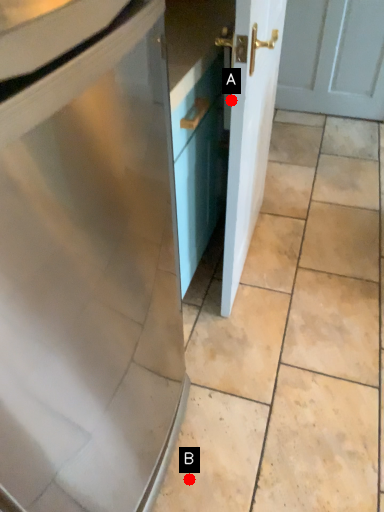
Question: Two points are circled on the image, labeled by A and B beside each circle. Which of the following is the farthest from the observer?

Choices:
 (A) A is further
 (B) B is further

Answer: (A)